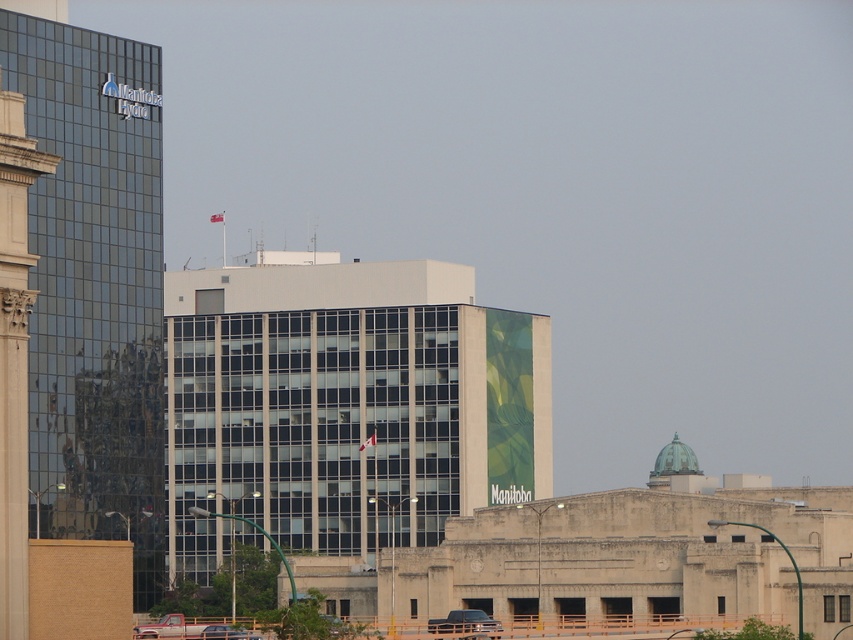
How much distance is there between glassy reflective building at left and metallic silver car at center?

54.27 feet

Is point (38, 179) positioned in front of point (242, 636)?

Yes, it is.

The height and width of the screenshot is (640, 853). What are the coordinates of `glassy reflective building at left` in the screenshot? It's located at (93, 284).

Which is more to the left, glassy reflective building at left or matte black truck at center?

glassy reflective building at left is more to the left.

Which is behind, point (131, 413) or point (480, 620)?

Point (131, 413)

Identify the location of glassy reflective building at left. (93, 284).

Who is positioned more to the left, matte black truck at center or metallic silver car at center?

From the viewer's perspective, metallic silver car at center appears more on the left side.

Based on the photo, does matte black truck at center appear on the right side of metallic silver car at center?

Indeed, matte black truck at center is positioned on the right side of metallic silver car at center.

Who is more forward, (474, 625) or (247, 634)?

Point (474, 625) is more forward.

You are a GUI agent. You are given a task and a screenshot of the screen. Output one action in this format:
    pyautogui.click(x=<x>, y=<y>)
    Task: Click on the matte black truck at center
    
    Given the screenshot: What is the action you would take?
    pyautogui.click(x=463, y=621)